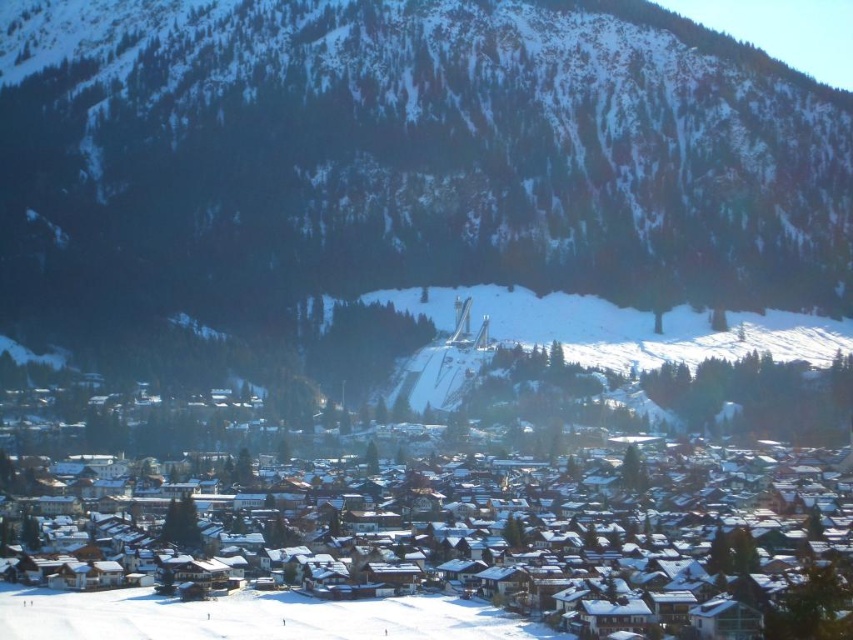
You are standing in the winter scene and want to take a photo of the two points marked in the image. Which point, point (844, 138) or point (505, 566), is closer to you?

Point (505, 566) is closer to you because it is less further to the camera than point (844, 138).